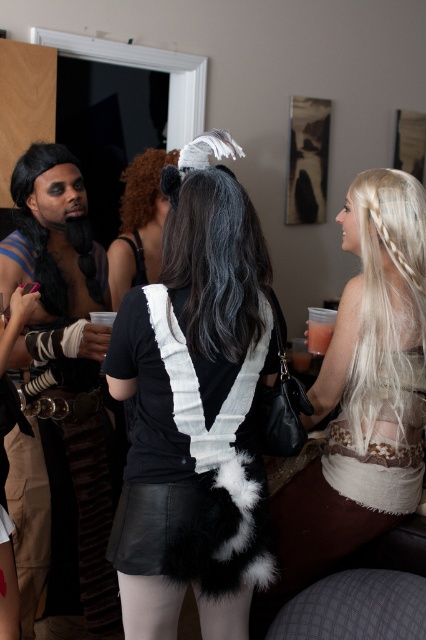
You are a photographer at the event and need to capture a group photo. The two wigs in the scene are the black synthetic wig at left and the curly brown wig at center. Which wig takes up more space in the photo?

The curly brown wig at center takes up more space in the photo because it occupies more space than the black synthetic wig at left.

You are at a costume party and notice two wigs displayed on a table. The black leather wig at center and the black synthetic wig at left. Which wig is positioned to the right of the other?

The black leather wig at center is positioned to the right of the black synthetic wig at left.

From the picture: You are a photographer standing at the center of the room with a camera that has a focal length of 50mm. You want to take a portrait of the black leather wig at center. What is the minimum distance you need to move forward or backward to ensure the wig fills the frame properly, considering the camera requires a subject to be at least 1.5 meters away for optimal focus?

The black leather wig at center is currently 1.42 meters away from the viewer. Since the camera requires a subject to be at least 1.5 meters away for optimal focus, you need to move 0.08 meters backward to achieve the required distance.